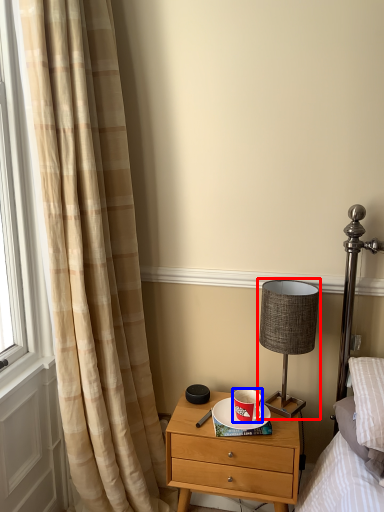
Question: Which of the following is the farthest to the observer, table lamp (highlighted by a red box) or coffee cup (highlighted by a blue box)?

Choices:
 (A) table lamp
 (B) coffee cup

Answer: (B)